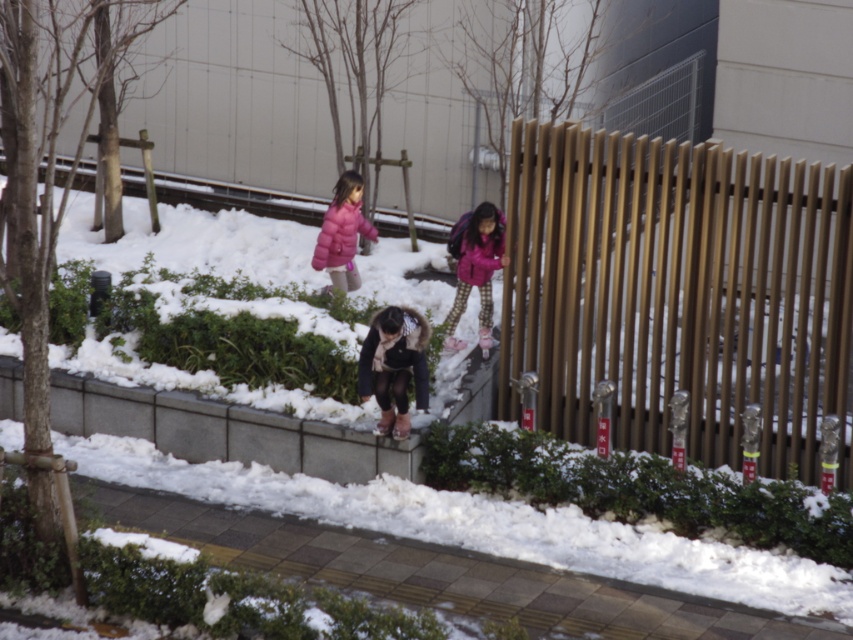
You are standing at the point labeled as point (490, 324) in the snowy urban scene. You want to walk towards the point labeled as point (422, 355). Based on the scene description, will you be moving forward or backward relative to your current position?

Since point (422, 355) is in front of point (490, 324), moving towards it would mean you are moving forward relative to your current position at point (490, 324).